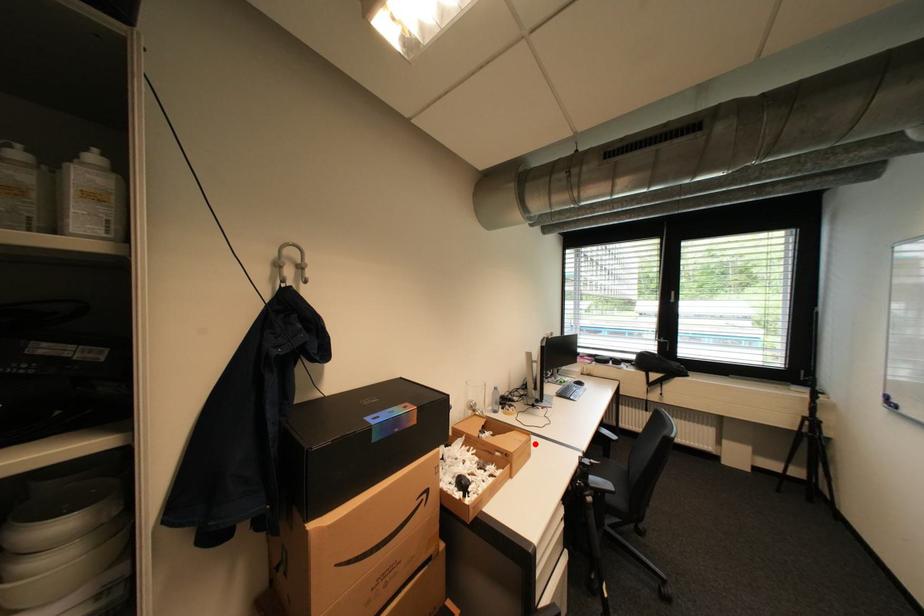
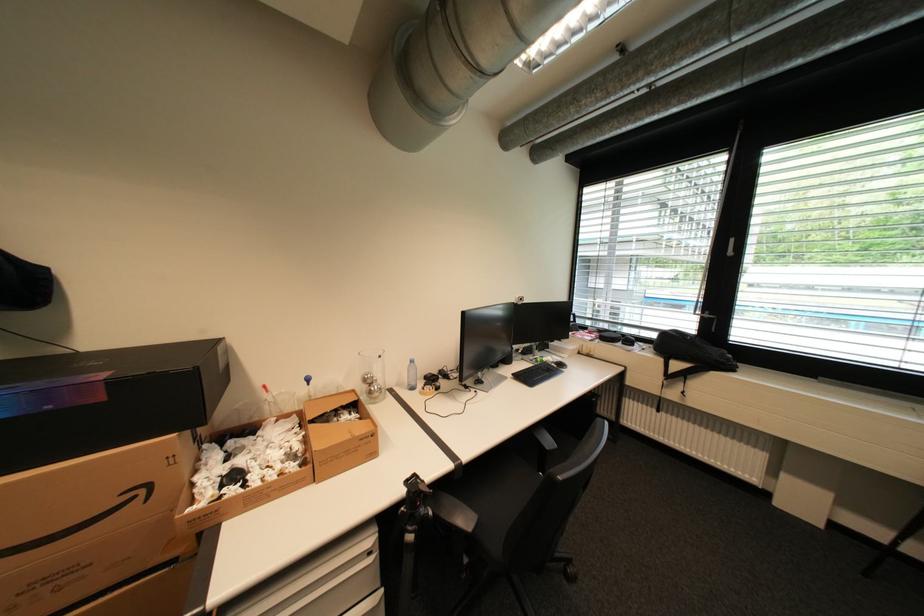
Where in the second image is the point corresponding to the highlighted location from the first image?

(370, 440)